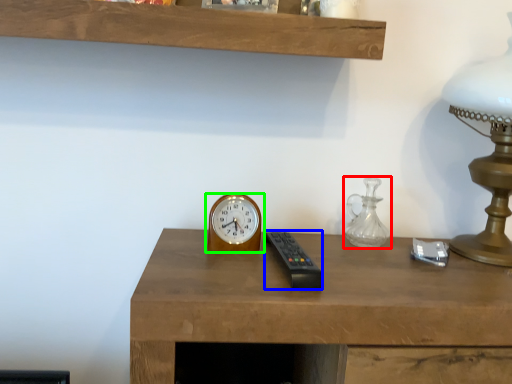
Question: Which object is the farthest from glass vase (highlighted by a red box)? Choose among these: control (highlighted by a blue box) or wall clock (highlighted by a green box).

Choices:
 (A) control
 (B) wall clock

Answer: (B)